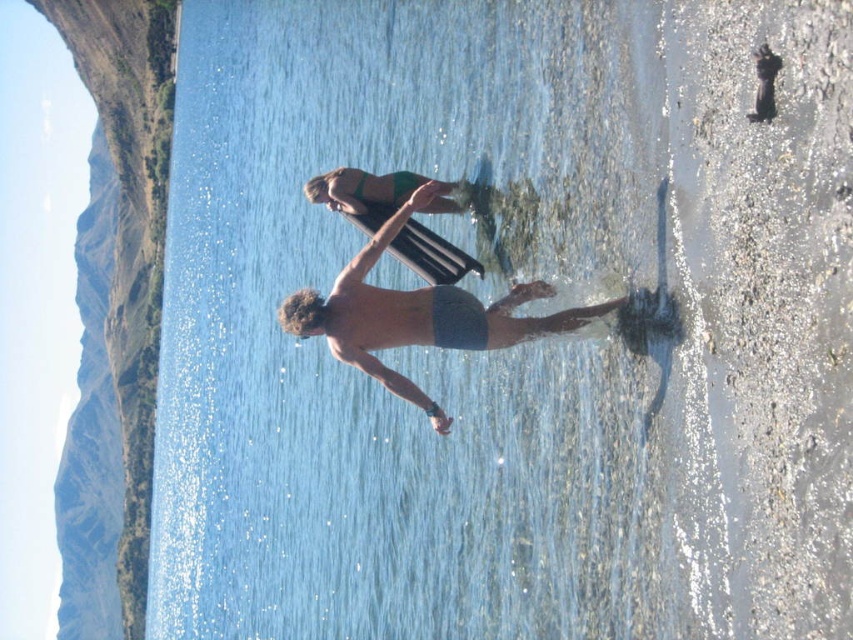
Which is behind, point (149, 212) or point (468, 310)?

Positioned behind is point (149, 212).

Does rocky cliff at left appear over gray fabric shorts at center?

Indeed, rocky cliff at left is positioned over gray fabric shorts at center.

Where is `rocky cliff at left`? The image size is (853, 640). rocky cliff at left is located at coordinates (131, 232).